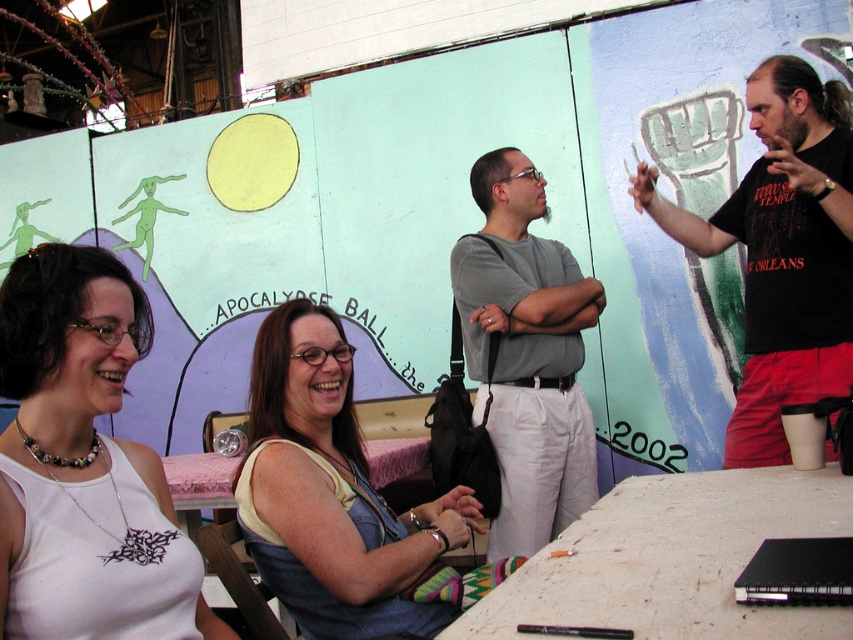
Which is above, black t-shirt at upper right or white matte tank top at lower left?

black t-shirt at upper right

Does point (741, 179) lie in front of point (108, 365)?

No, it is not.

Where is `black t-shirt at upper right`? The image size is (853, 640). black t-shirt at upper right is located at coordinates [781, 252].

Who is taller, black t-shirt at upper right or gray cotton shirt at center?

Standing taller between the two is gray cotton shirt at center.

Who is lower down, black t-shirt at upper right or gray cotton shirt at center?

gray cotton shirt at center

I want to click on black t-shirt at upper right, so click(x=781, y=252).

Is point (312, 614) positioned before point (126, 556)?

No, it is behind (126, 556).

What do you see at coordinates (331, 493) in the screenshot? Image resolution: width=853 pixels, height=640 pixels. I see `denim vest at center` at bounding box center [331, 493].

Find the location of a particular element. The height and width of the screenshot is (640, 853). denim vest at center is located at coordinates (331, 493).